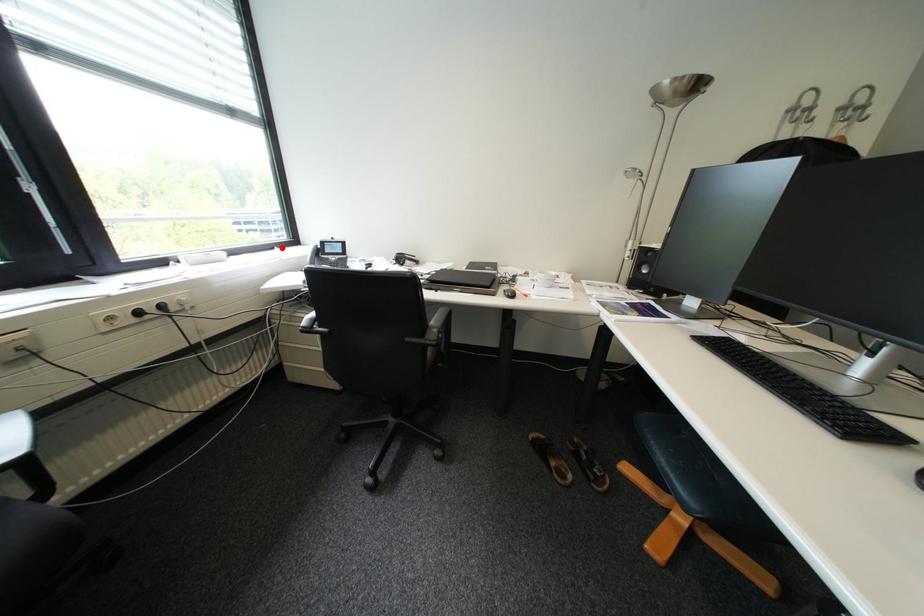
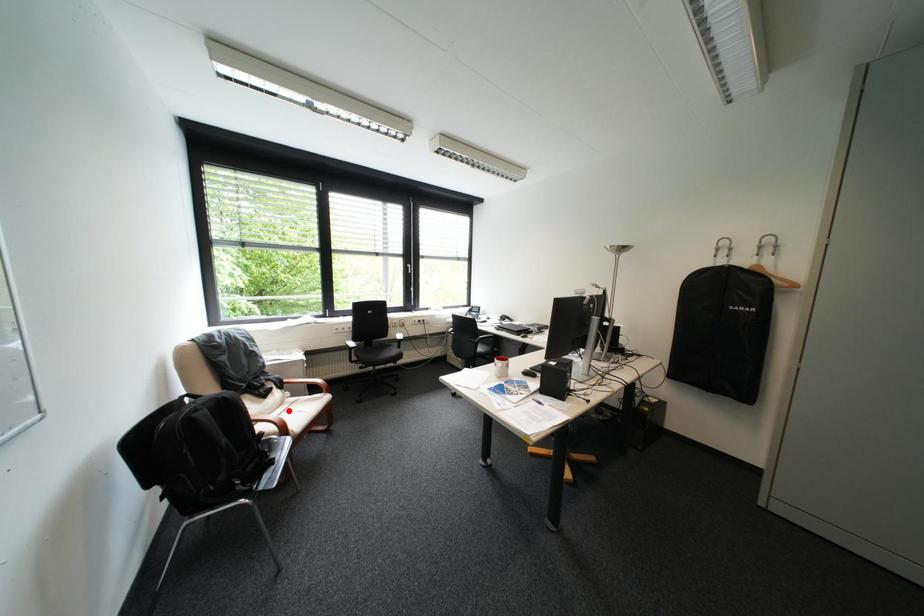
I am providing you with two images of the same scene from different viewpoints. A red point is marked on the first image and another point is marked on the second image. Is the red point in image1 aligned with the point shown in image2?

No